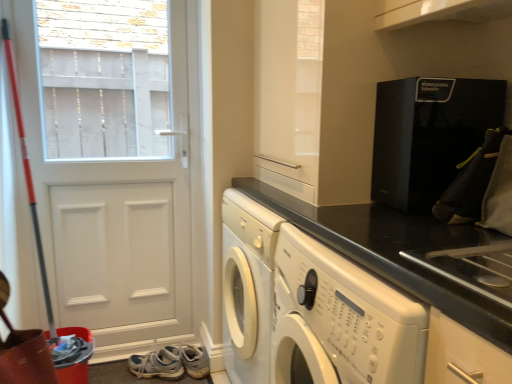
Question: Does black granite countertop at center appear on the right side of black textured coffee machine at upper right?

Choices:
 (A) yes
 (B) no

Answer: (B)

Question: Does black granite countertop at center contain black textured coffee machine at upper right?

Choices:
 (A) yes
 (B) no

Answer: (B)

Question: Considering the relative sizes of black granite countertop at center and black textured coffee machine at upper right in the image provided, is black granite countertop at center taller than black textured coffee machine at upper right?

Choices:
 (A) no
 (B) yes

Answer: (B)

Question: From a real-world perspective, is black granite countertop at center on black textured coffee machine at upper right?

Choices:
 (A) no
 (B) yes

Answer: (A)

Question: Is black granite countertop at center behind black textured coffee machine at upper right?

Choices:
 (A) no
 (B) yes

Answer: (B)

Question: Is black granite countertop at center wider than black textured coffee machine at upper right?

Choices:
 (A) yes
 (B) no

Answer: (A)

Question: Is black textured coffee machine at upper right far from white matte door at left?

Choices:
 (A) yes
 (B) no

Answer: (A)

Question: Is black textured coffee machine at upper right completely or partially outside of white matte door at left?

Choices:
 (A) yes
 (B) no

Answer: (A)

Question: Is black textured coffee machine at upper right in front of white matte door at left?

Choices:
 (A) yes
 (B) no

Answer: (A)

Question: From a real-world perspective, is black textured coffee machine at upper right beneath white matte door at left?

Choices:
 (A) no
 (B) yes

Answer: (A)

Question: From the image's perspective, is black textured coffee machine at upper right on white matte door at left?

Choices:
 (A) yes
 (B) no

Answer: (A)

Question: Is black textured coffee machine at upper right facing towards white matte door at left?

Choices:
 (A) no
 (B) yes

Answer: (A)

Question: Is white leather shoe at lower left positioned before white matte door at left?

Choices:
 (A) no
 (B) yes

Answer: (A)